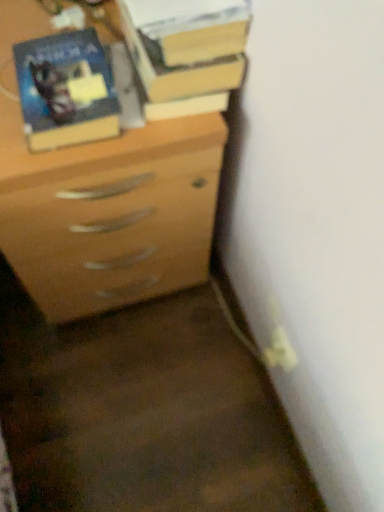
Identify the location of free spot above matte wood chest of drawers at center (from a real-world perspective). This screenshot has height=512, width=384. (99, 38).